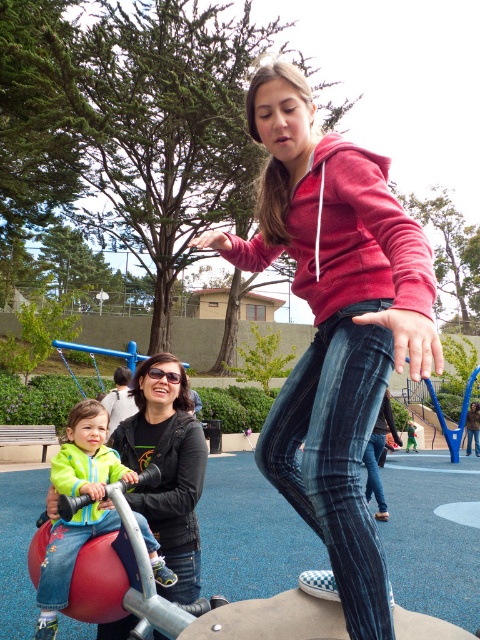
Question: Which of the following is the farthest from the observer?

Choices:
 (A) matte red hoodie at center
 (B) green fleece jacket at center

Answer: (B)

Question: Is matte red hoodie at center further to camera compared to green fleece jacket at center?

Choices:
 (A) no
 (B) yes

Answer: (A)

Question: Is matte red hoodie at center to the left of green fleece jacket at center from the viewer's perspective?

Choices:
 (A) yes
 (B) no

Answer: (B)

Question: Can you confirm if matte red hoodie at center is thinner than green fleece jacket at center?

Choices:
 (A) yes
 (B) no

Answer: (B)